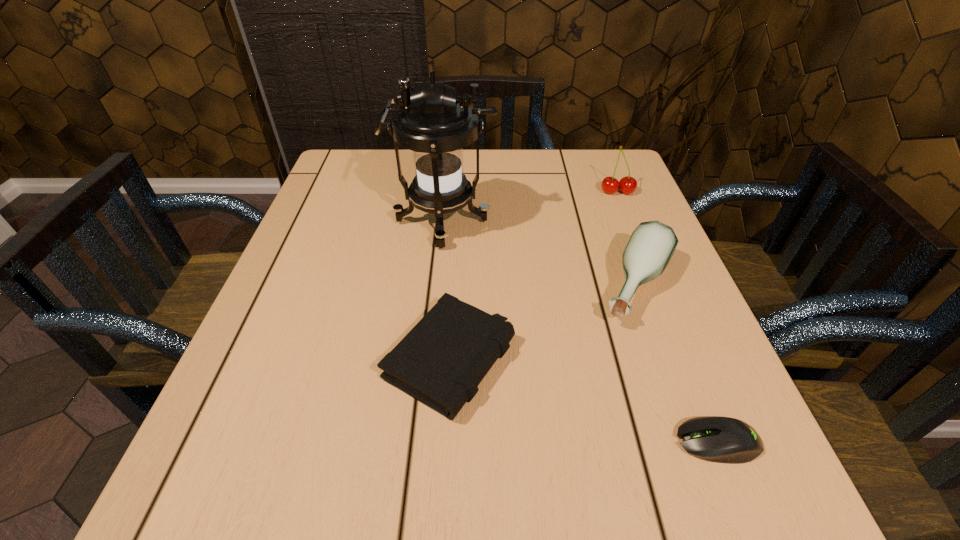
The width and height of the screenshot is (960, 540). Find the location of `free space between the third tallest object and the computer mouse`. free space between the third tallest object and the computer mouse is located at coordinates (678, 364).

At what (x,y) coordinates should I click in order to perform the action: click on vacant area that lies between the third tallest object and the computer mouse. Please return your answer as a coordinate pair (x, y). Looking at the image, I should click on (678, 364).

In order to click on free space between the lantern and the second shortest object in this screenshot , I will do `click(446, 291)`.

I want to click on empty space that is in between the cherry and the shortest object, so click(667, 317).

What are the coordinates of `free area in between the shortest object and the second shortest object` in the screenshot? It's located at (584, 401).

The image size is (960, 540). What are the coordinates of `vacant region between the Bible and the tallest object` in the screenshot? It's located at (446, 291).

You are a GUI agent. You are given a task and a screenshot of the screen. Output one action in this format:
    pyautogui.click(x=<x>, y=<y>)
    Task: Click on the vacant space that's between the lantern and the second tallest object
    
    Given the screenshot: What is the action you would take?
    pyautogui.click(x=530, y=207)

Locate an element on the screen. object that is the third closest to the second shortest object is located at coordinates (718, 439).

The image size is (960, 540). Identify the location of object that is the second closest to the computer mouse. (441, 361).

Where is `free space that satisfies the following two spatial constraints: 1. with the stems of the second tallest object pointing upwards; 2. on the wheel side of the shortest object`? The image size is (960, 540). free space that satisfies the following two spatial constraints: 1. with the stems of the second tallest object pointing upwards; 2. on the wheel side of the shortest object is located at coordinates (718, 442).